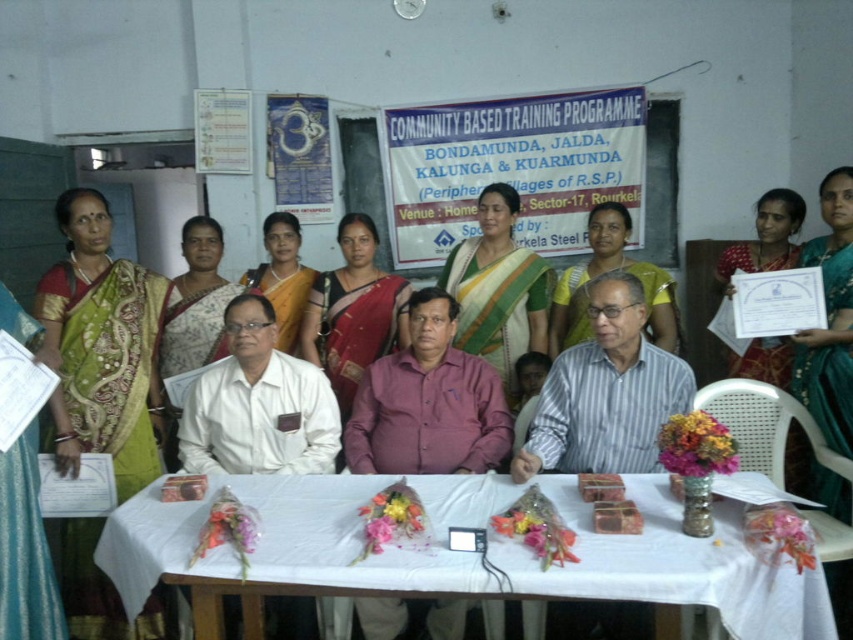
Question: Does white cloth-covered table at center appear over green silk saree at center?

Choices:
 (A) yes
 (B) no

Answer: (B)

Question: Which of these objects is positioned closest to the green silk saree at upper right?

Choices:
 (A) yellow-green sari at center
 (B) green sari at right

Answer: (B)

Question: Can you confirm if green silk saree at left is positioned below satin sari at center?

Choices:
 (A) yes
 (B) no

Answer: (A)

Question: Which object appears closest to the camera in this image?

Choices:
 (A) satin sari at center
 (B) green sari at center

Answer: (A)

Question: Where is green silk saree at center located in relation to yellow-green sari at center in the image?

Choices:
 (A) above
 (B) below

Answer: (B)

Question: Which is nearer to the white cloth-covered table at center?

Choices:
 (A) green sari at center
 (B) white saree at center
 (C) yellow-green sari at center
 (D) satin sari at center

Answer: (D)